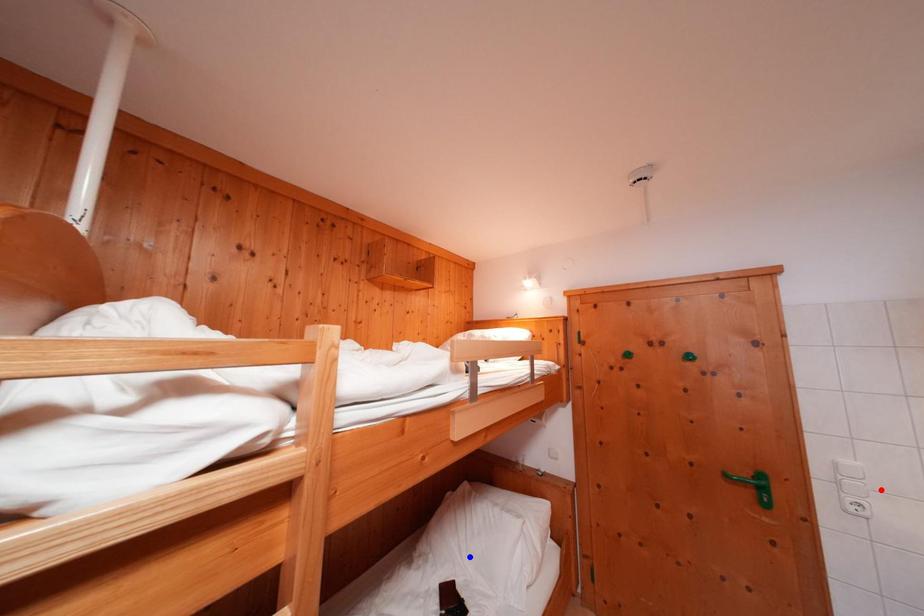
Question: Which of the two points in the image is closer to the camera?

Choices:
 (A) Blue point is closer.
 (B) Red point is closer.

Answer: (B)